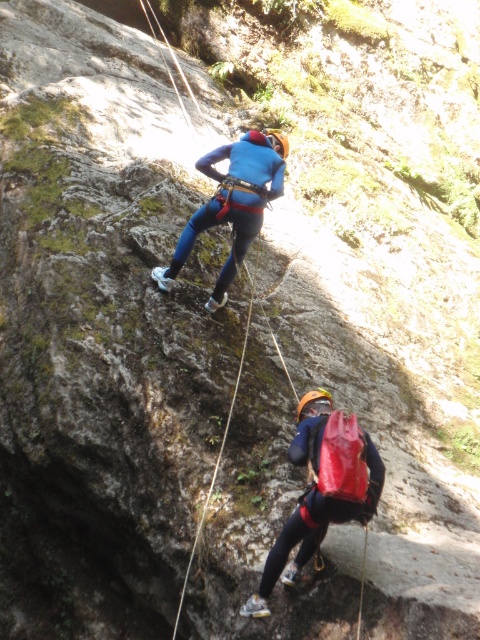
Question: Does matte red backpack at lower center appear over blue matte climbing suit at center?

Choices:
 (A) yes
 (B) no

Answer: (B)

Question: Which object appears farthest from the camera in this image?

Choices:
 (A) matte red backpack at lower center
 (B) blue matte climbing suit at center

Answer: (B)

Question: Is matte red backpack at lower center thinner than blue matte climbing suit at center?

Choices:
 (A) no
 (B) yes

Answer: (B)

Question: Does matte red backpack at lower center appear under blue matte climbing suit at center?

Choices:
 (A) yes
 (B) no

Answer: (A)